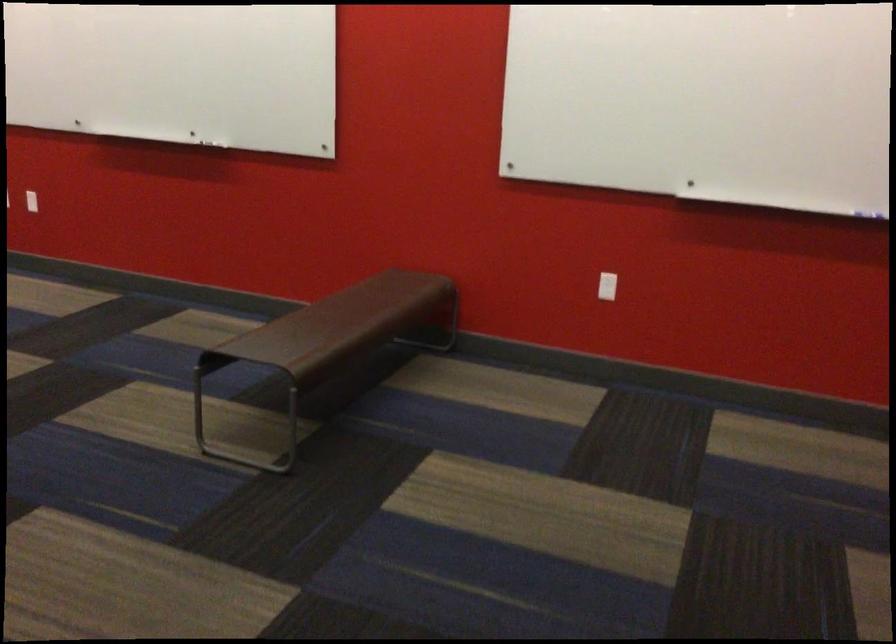
Describe the element at coordinates (359, 317) in the screenshot. This screenshot has height=644, width=896. I see `a bench sitting surface` at that location.